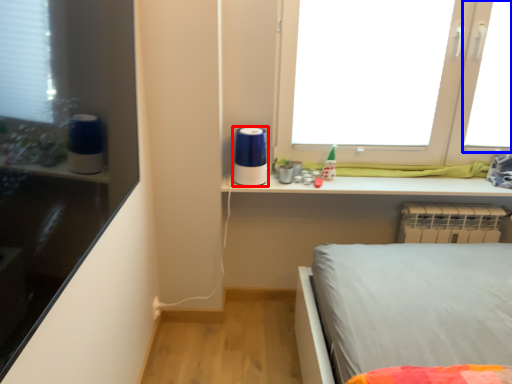
Question: Which of the following is the farthest to the observer, appliance (highlighted by a red box) or window screen (highlighted by a blue box)?

Choices:
 (A) appliance
 (B) window screen

Answer: (B)